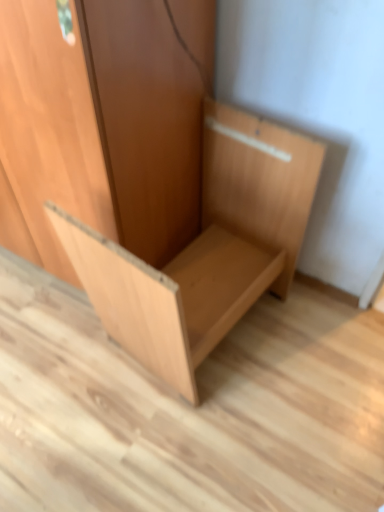
Question: Should I look upward or downward to see light brown wood chair at center?

Choices:
 (A) up
 (B) down

Answer: (B)